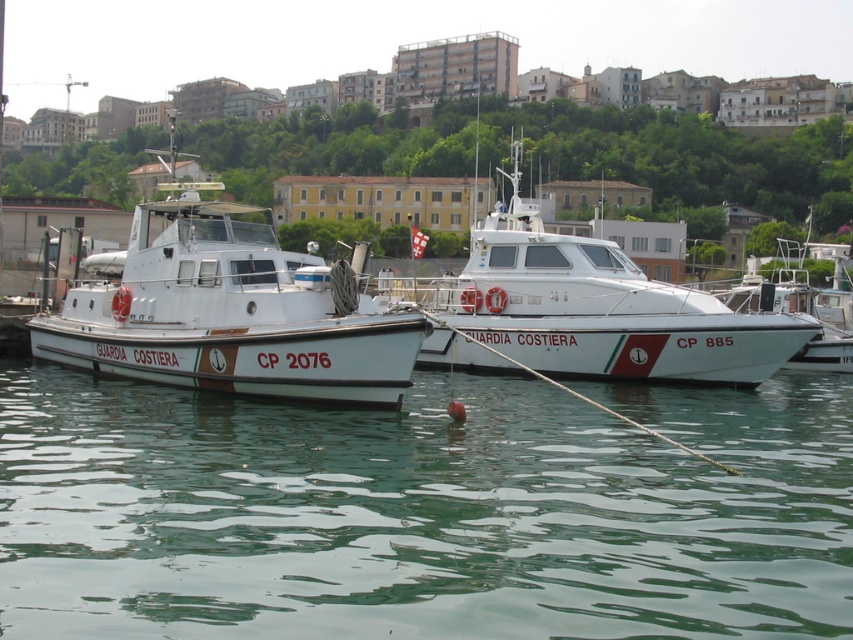
Question: Among these objects, which one is farthest from the camera?

Choices:
 (A) green smooth water at center
 (B) white glossy boat at center

Answer: (B)

Question: Which object appears farthest from the camera in this image?

Choices:
 (A) white glossy boat at left
 (B) green smooth water at center
 (C) white glossy boat at center

Answer: (C)

Question: Is the position of white glossy boat at left more distant than that of white glossy boat at center?

Choices:
 (A) no
 (B) yes

Answer: (A)

Question: Where is green smooth water at center located in relation to white glossy boat at left in the image?

Choices:
 (A) right
 (B) left

Answer: (A)

Question: Which object appears closest to the camera in this image?

Choices:
 (A) white glossy boat at center
 (B) green smooth water at center

Answer: (B)

Question: Does green smooth water at center lie in front of white glossy boat at center?

Choices:
 (A) no
 (B) yes

Answer: (B)